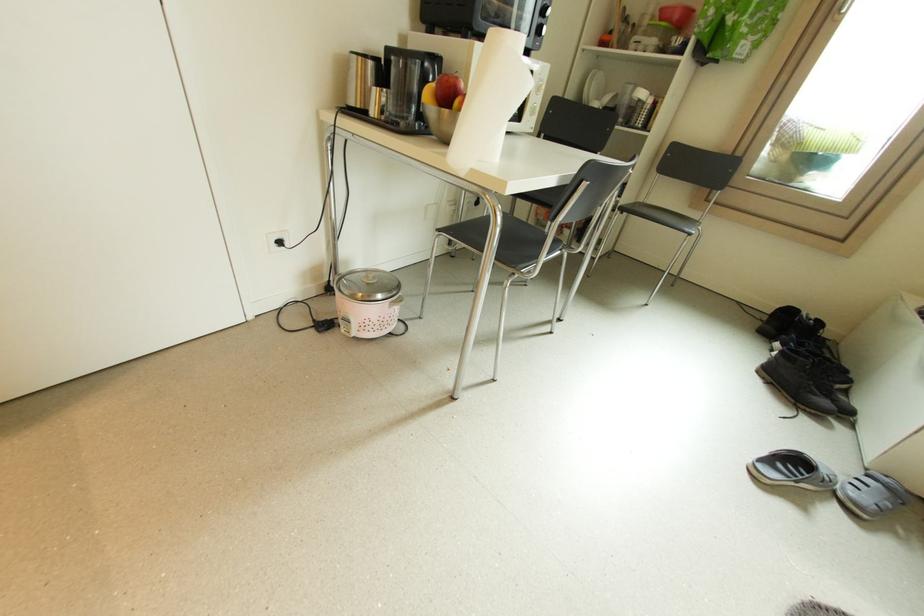
Locate an element on the screen. rice cooker lid handle is located at coordinates (371, 276).